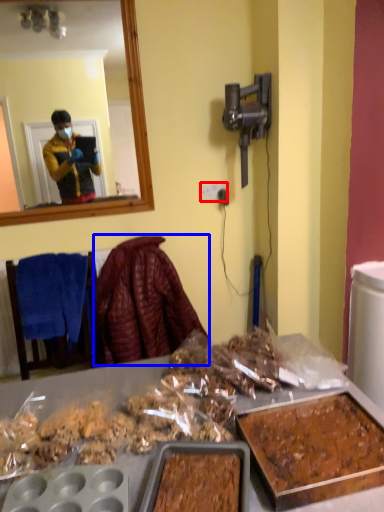
Question: Among these objects, which one is farthest to the camera, power outlet (highlighted by a red box) or blanket (highlighted by a blue box)?

Choices:
 (A) power outlet
 (B) blanket

Answer: (A)